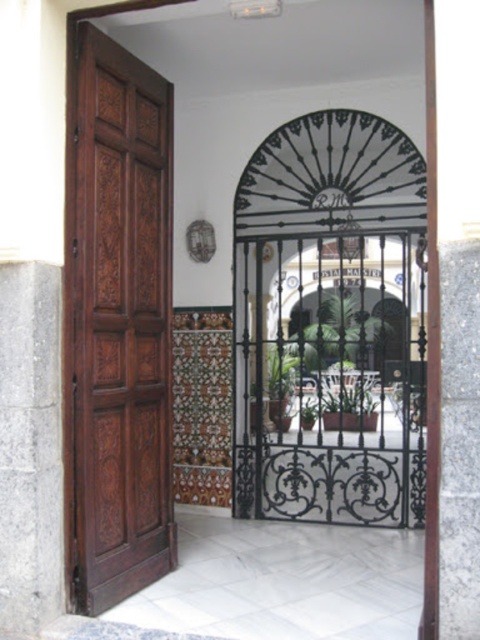
You are standing at the entrance of the Spanish building and want to walk towards the brown carved wood door at left and the gray stone pillar at left. Which object will you reach first?

The brown carved wood door at left is closer to you than the gray stone pillar at left, so you will reach the brown carved wood door at left first.

Based on the photo, you are standing in front of the entrance of the Spanish style building. You see a point at coordinate (120, 321). What object is located at that point?

The point at coordinate (120, 321) indicates the brown carved wood door at left.

You are standing in front of the entrance and want to walk through the open space between the brown carved wood door at left and the brown wood pillar at right. Can you pass through without touching either?

The brown carved wood door at left is to the left of brown wood pillar at right, so there is space between them. You can pass through without touching either.